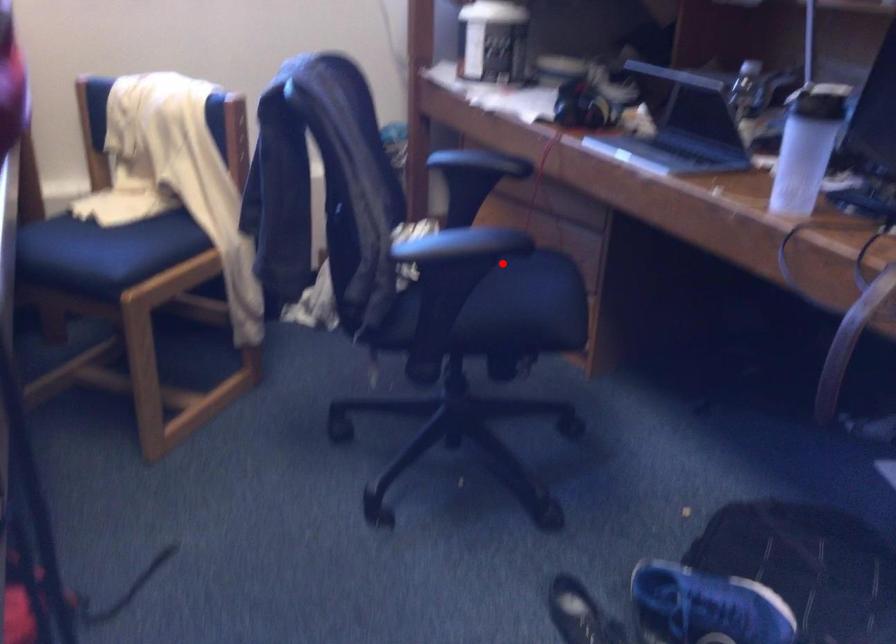
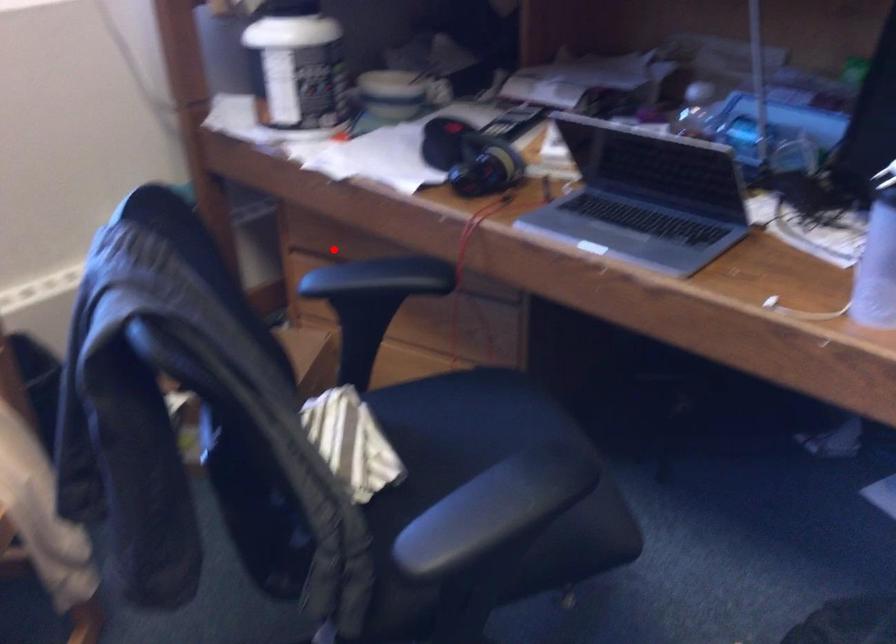
I am providing you with two images of the same scene from different viewpoints. A red point is marked on the first image and another point is marked on the second image. Does the point marked in image1 correspond to the same location as the one in image2?

No